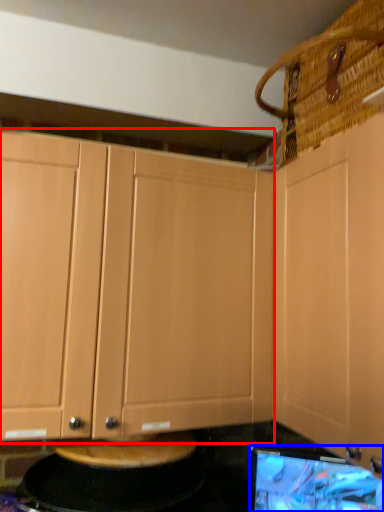
Question: Among these objects, which one is farthest to the camera, cabinetry (highlighted by a red box) or computer monitor (highlighted by a blue box)?

Choices:
 (A) cabinetry
 (B) computer monitor

Answer: (A)